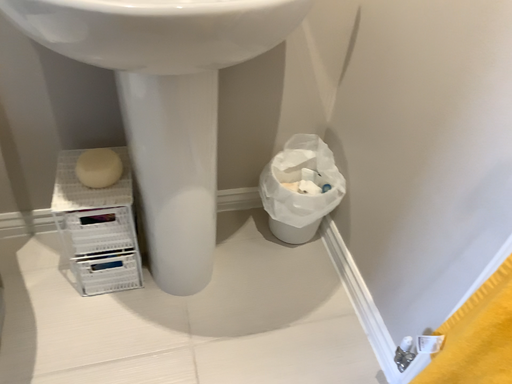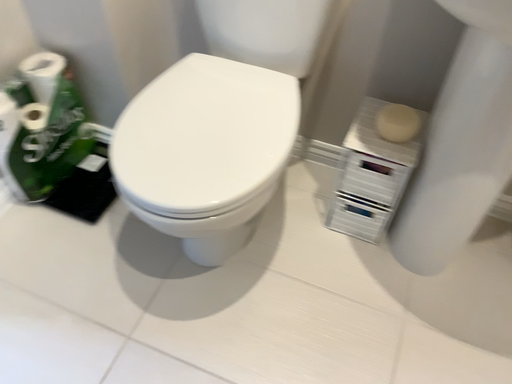
Question: Which way did the camera rotate in the video?

Choices:
 (A) rotated right
 (B) rotated left

Answer: (B)